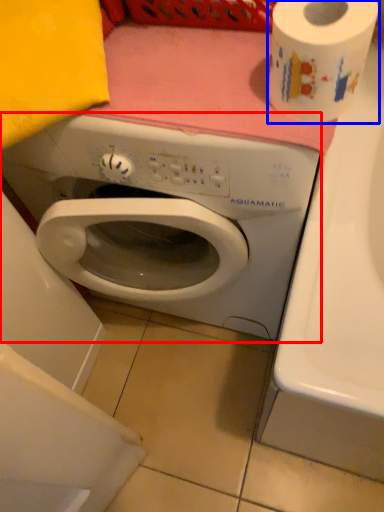
Question: Among these objects, which one is farthest to the camera, washing machine (highlighted by a red box) or toilet paper (highlighted by a blue box)?

Choices:
 (A) washing machine
 (B) toilet paper

Answer: (A)